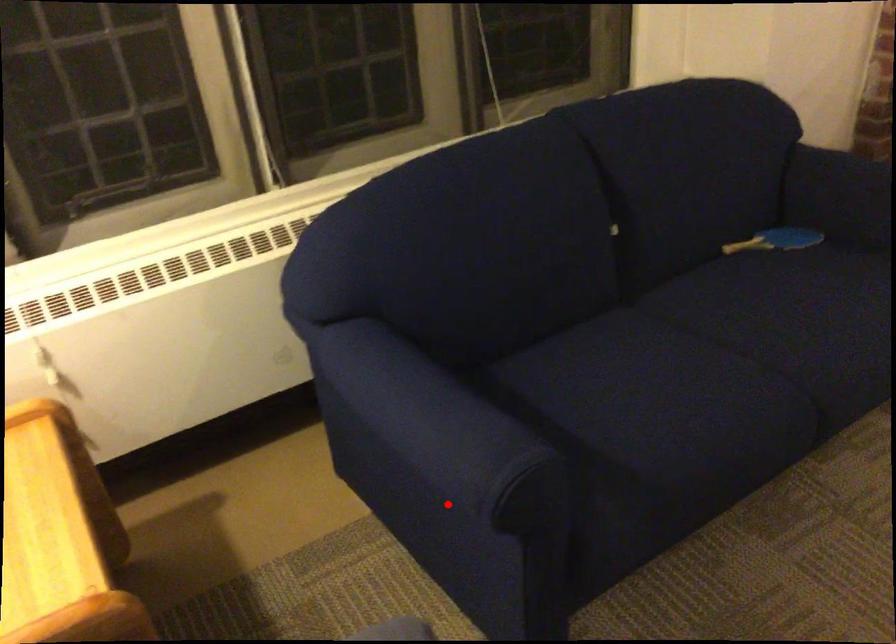
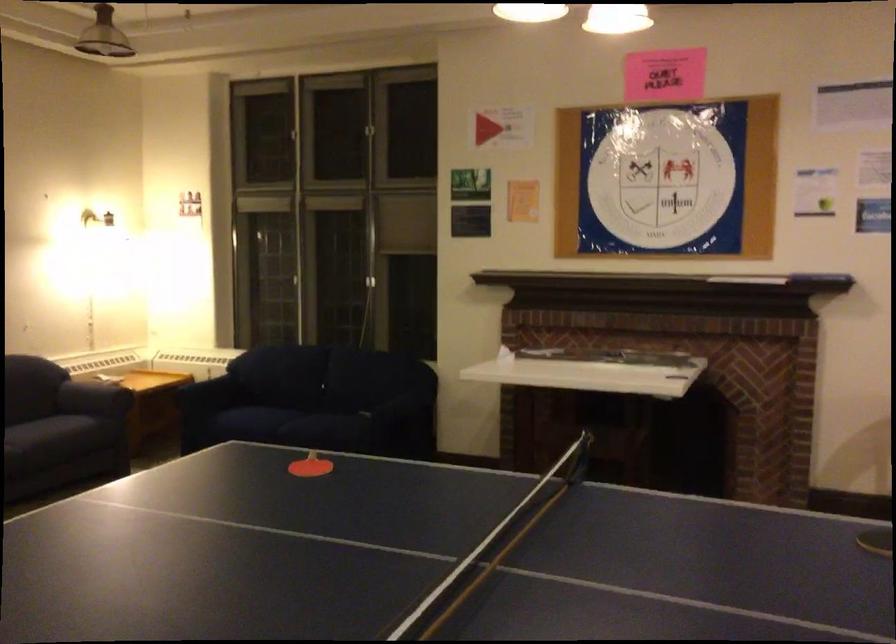
The point at the highlighted location is marked in the first image. Where is the corresponding point in the second image?

(185, 398)